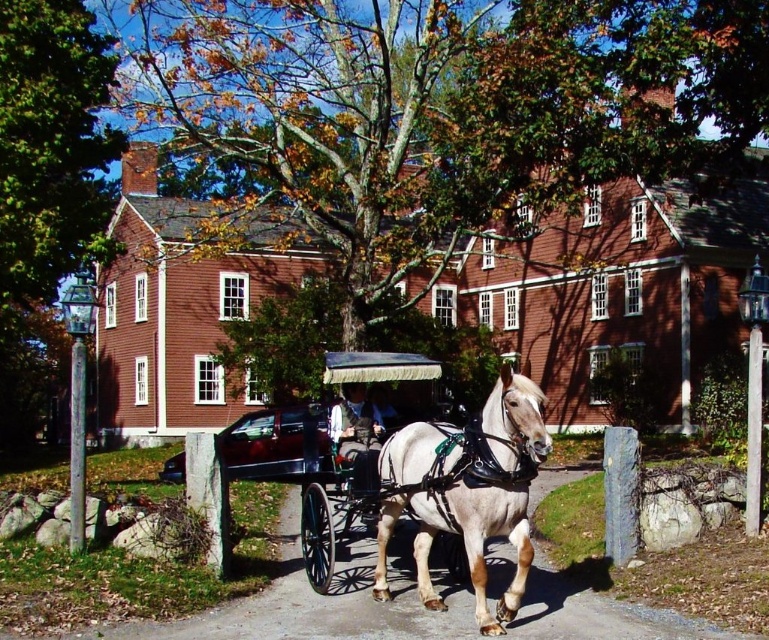
Does white glossy horse at center appear on the left side of white leather wagon at center?

No, white glossy horse at center is not to the left of white leather wagon at center.

Is white glossy horse at center in front of white leather wagon at center?

That is True.

Is point (518, 486) behind point (333, 417)?

No.

At what (x,y) coordinates should I click in order to perform the action: click on white glossy horse at center. Please return your answer as a coordinate pair (x, y). This screenshot has height=640, width=769. Looking at the image, I should click on [468, 490].

Looking at this image, does white glossy horse at center appear on the left side of smooth black coach at center?

In fact, white glossy horse at center is to the right of smooth black coach at center.

Where is `white glossy horse at center`? The height and width of the screenshot is (640, 769). white glossy horse at center is located at coordinates (468, 490).

Is the position of white leather wagon at center more distant than that of smooth black coach at center?

No, white leather wagon at center is in front of smooth black coach at center.

Does white leather wagon at center have a greater height compared to smooth black coach at center?

Indeed, white leather wagon at center has a greater height compared to smooth black coach at center.

Is point (358, 417) more distant than point (348, 435)?

That is True.

Locate an element on the screen. white leather wagon at center is located at coordinates (353, 449).